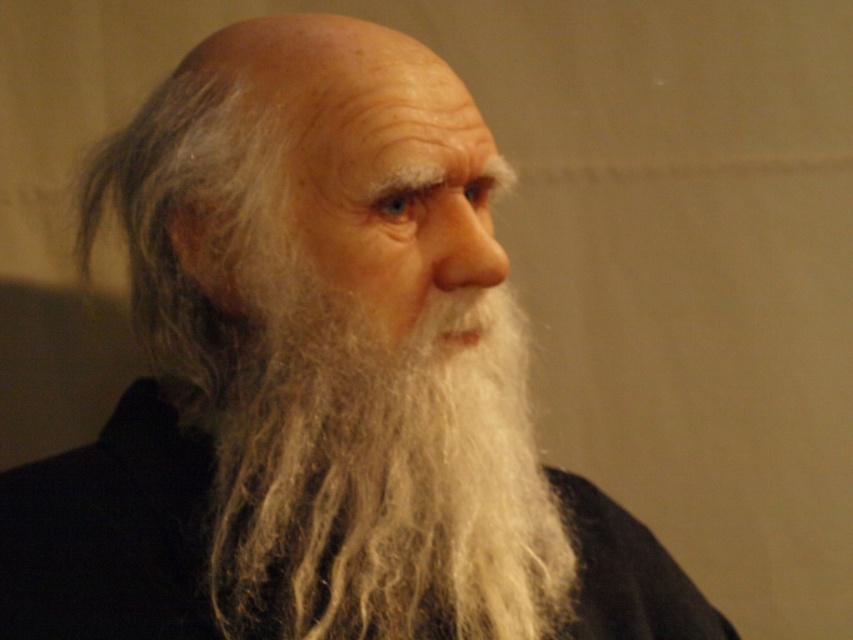
Question: From the image, what is the correct spatial relationship of white woolen beard at center in relation to silky black robe at center?

Choices:
 (A) below
 (B) above

Answer: (B)

Question: Which object appears closest to the camera in this image?

Choices:
 (A) silky black robe at center
 (B) white woolen beard at center

Answer: (B)

Question: Is white woolen beard at center wider than silky black robe at center?

Choices:
 (A) yes
 (B) no

Answer: (A)

Question: Observing the image, what is the correct spatial positioning of white woolen beard at center in reference to silky black robe at center?

Choices:
 (A) above
 (B) below

Answer: (A)